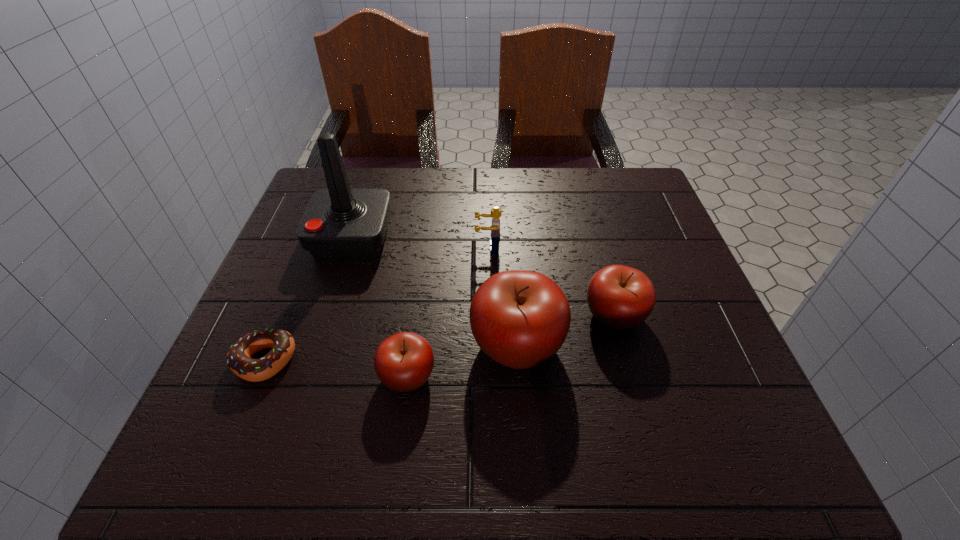
Locate an element on the screen. This screenshot has width=960, height=540. free space located on the back of the second tallest object is located at coordinates (511, 258).

Where is `vacant space situated 0.300m on the left of the second tallest apple`? Image resolution: width=960 pixels, height=540 pixels. vacant space situated 0.300m on the left of the second tallest apple is located at coordinates (431, 315).

Where is `free space located on the face of the Lego`? free space located on the face of the Lego is located at coordinates (440, 247).

At what (x,y) coordinates should I click in order to perform the action: click on blank space located on the face of the Lego. Please return your answer as a coordinate pair (x, y). Image resolution: width=960 pixels, height=540 pixels. Looking at the image, I should click on (419, 247).

Image resolution: width=960 pixels, height=540 pixels. Find the location of `free location located on the face of the Lego`. free location located on the face of the Lego is located at coordinates (319, 247).

I want to click on free space located 0.060m on the back of the shortest object, so click(x=284, y=313).

Where is `free space located on the right of the joystick`? The image size is (960, 540). free space located on the right of the joystick is located at coordinates (526, 237).

Image resolution: width=960 pixels, height=540 pixels. In order to click on object present at the far edge in this screenshot , I will do `click(339, 222)`.

Find the location of a particular element. doughnut at the near edge is located at coordinates (239, 360).

The height and width of the screenshot is (540, 960). I want to click on doughnut that is at the left edge, so click(x=239, y=360).